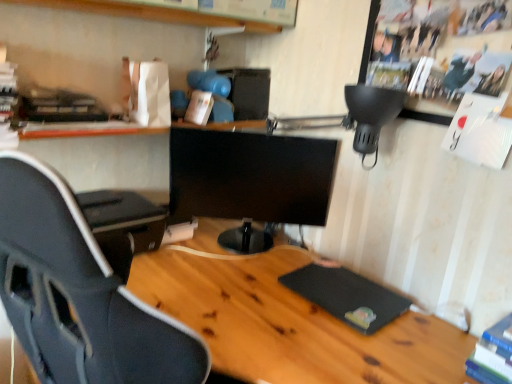
The image size is (512, 384). I want to click on free space to the left of black glossy monitor at center, so click(180, 256).